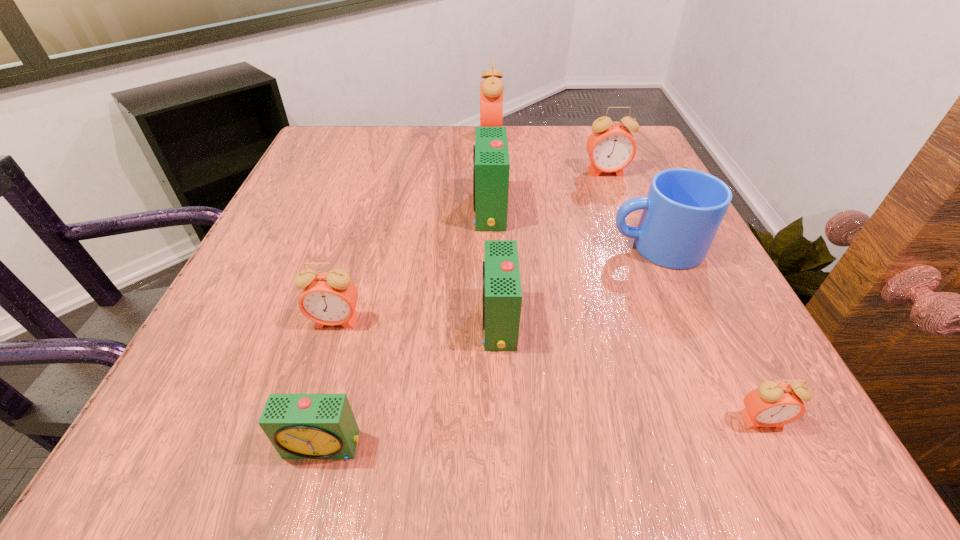
Find the location of a particular element. This screenshot has height=540, width=960. green alarm clock that is the closest to the second biggest green alarm clock is located at coordinates (491, 165).

Identify the location of blank space that satisfies the following two spatial constraints: 1. on the face of the second farthest alarm clock; 2. on the front-facing side of the second nearest green alarm clock. The width and height of the screenshot is (960, 540). click(664, 322).

Where is `vacant space that satisfies the following two spatial constraints: 1. on the front-facing side of the farthest green alarm clock; 2. on the face of the second nearest pink alarm clock`? The height and width of the screenshot is (540, 960). vacant space that satisfies the following two spatial constraints: 1. on the front-facing side of the farthest green alarm clock; 2. on the face of the second nearest pink alarm clock is located at coordinates (492, 321).

Locate an element on the screen. The image size is (960, 540). vacant space that satisfies the following two spatial constraints: 1. on the face of the farthest object; 2. on the front-facing side of the smallest green alarm clock is located at coordinates (503, 446).